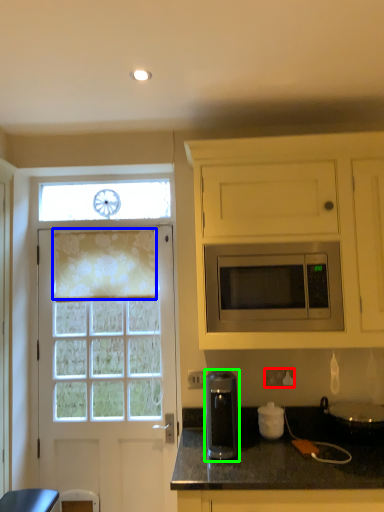
Question: Estimate the real-world distances between objects in this image. Which object is farther from electric outlet (highlighted by a red box), curtain (highlighted by a blue box) or coffee machine (highlighted by a green box)?

Choices:
 (A) curtain
 (B) coffee machine

Answer: (A)